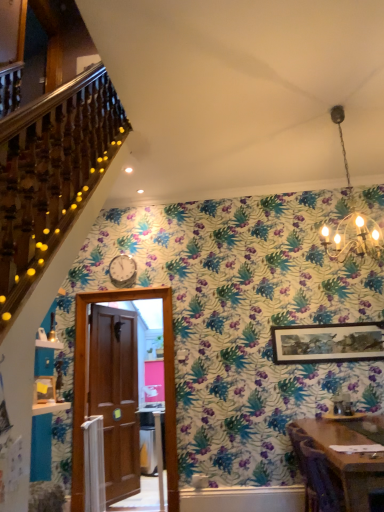
Question: Considering the relative sizes of wooden table at lower right and brown wooden door at center in the image provided, is wooden table at lower right wider than brown wooden door at center?

Choices:
 (A) yes
 (B) no

Answer: (A)

Question: Does wooden table at lower right have a lesser height compared to brown wooden door at center?

Choices:
 (A) no
 (B) yes

Answer: (B)

Question: Can brown wooden door at center be found inside wooden table at lower right?

Choices:
 (A) no
 (B) yes

Answer: (A)

Question: Is wooden table at lower right outside brown wooden door at center?

Choices:
 (A) no
 (B) yes

Answer: (B)

Question: Does wooden table at lower right have a lesser width compared to brown wooden door at center?

Choices:
 (A) yes
 (B) no

Answer: (B)

Question: Is point (170, 297) closer or farther from the camera than point (357, 328)?

Choices:
 (A) closer
 (B) farther

Answer: (B)

Question: In the image, is brown wooden door at center positioned in front of or behind wooden framed artwork at upper right?

Choices:
 (A) front
 (B) behind

Answer: (A)

Question: Based on their positions, is brown wooden door at center located to the left or right of wooden framed artwork at upper right?

Choices:
 (A) right
 (B) left

Answer: (B)

Question: Choose the correct answer: Is brown wooden door at center inside wooden framed artwork at upper right or outside it?

Choices:
 (A) outside
 (B) inside

Answer: (A)

Question: Based on their positions, is brown wooden door at center located to the left or right of gold chain chandelier at upper center?

Choices:
 (A) right
 (B) left

Answer: (B)

Question: Is brown wooden door at center spatially inside gold chain chandelier at upper center, or outside of it?

Choices:
 (A) inside
 (B) outside

Answer: (B)

Question: Is brown wooden door at center wider or thinner than gold chain chandelier at upper center?

Choices:
 (A) wide
 (B) thin

Answer: (B)

Question: Is brown wooden door at center bigger or smaller than gold chain chandelier at upper center?

Choices:
 (A) small
 (B) big

Answer: (A)

Question: Looking at their shapes, would you say wooden table at lower right is wider or thinner than wooden framed artwork at upper right?

Choices:
 (A) wide
 (B) thin

Answer: (A)

Question: Relative to wooden framed artwork at upper right, is wooden table at lower right in front or behind?

Choices:
 (A) behind
 (B) front

Answer: (B)